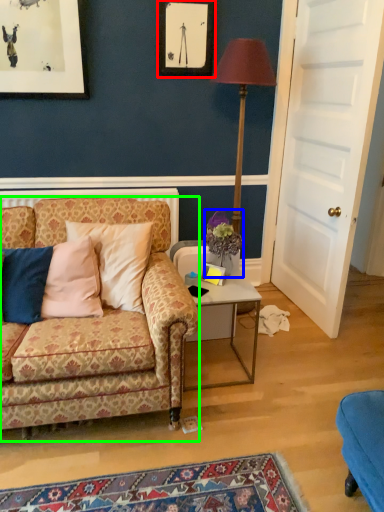
Question: Considering the real-world distances, which object is farthest from picture frame (highlighted by a red box)? flower (highlighted by a blue box) or studio couch (highlighted by a green box)?

Choices:
 (A) flower
 (B) studio couch

Answer: (B)